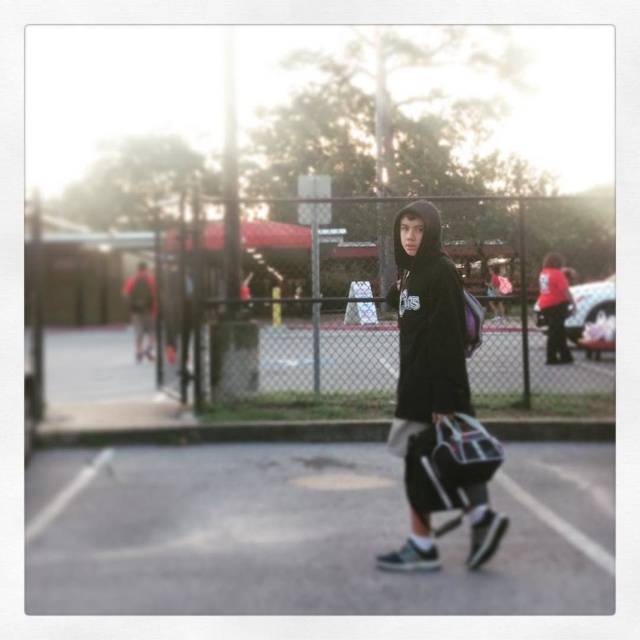
You are a security guard monitoring the parking lot. You notice two dark clothing items at the center of the scene. Can you determine if there is enough space between the black fleece sweatshirt at center and the matte black hoodie at center for a small dog to pass through?

The distance between the black fleece sweatshirt at center and the matte black hoodie at center is 10.88 meters, which is more than sufficient for a small dog to pass through comfortably.

You are trying to decide which hoodie to wear for a cold evening walk. Both the black fleece hoodie at center and the matte black hoodie at center are available. Based on the image, which one would you choose and why?

The black fleece hoodie at center is thinner than the matte black hoodie at center, so the matte black hoodie at center would provide better insulation for a cold evening walk.

You are a security camera monitoring the parking lot. You notice two dark clothing items at the center of the scene. Which one is taller between the black fleece hoodie at center and the black fleece sweatshirt at center?

The black fleece hoodie at center is taller than the black fleece sweatshirt at center.